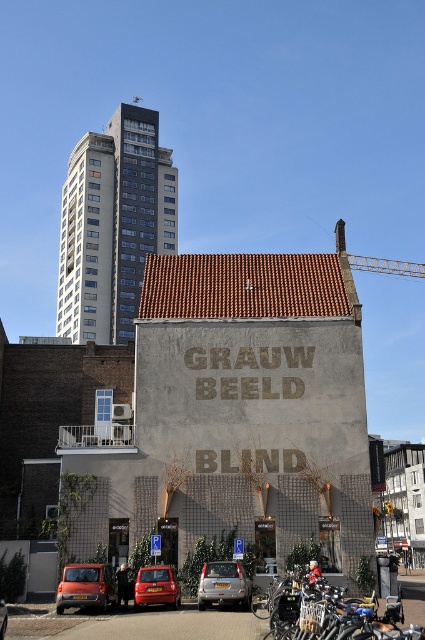
Is matte orange car at lower left bigger than metallic gray crane at upper right?

No.

The height and width of the screenshot is (640, 425). In order to click on matte orange car at lower left in this screenshot , I will do `click(85, 588)`.

In order to click on matte orange car at lower left in this screenshot , I will do point(85,588).

Looking at this image, who is more forward, (82, 572) or (178, 589)?

Point (82, 572)

Which is in front, point (67, 582) or point (138, 596)?

Positioned in front is point (138, 596).

Identify the location of matte orange car at lower left. (85, 588).

Is silver metallic car at center to the left of metallic gray crane at upper right from the viewer's perspective?

Yes, silver metallic car at center is to the left of metallic gray crane at upper right.

Between silver metallic car at center and metallic gray crane at upper right, which one is positioned higher?

metallic gray crane at upper right is above.

The height and width of the screenshot is (640, 425). What do you see at coordinates (223, 586) in the screenshot?
I see `silver metallic car at center` at bounding box center [223, 586].

Find the location of a particular element. The width and height of the screenshot is (425, 640). silver metallic car at center is located at coordinates (223, 586).